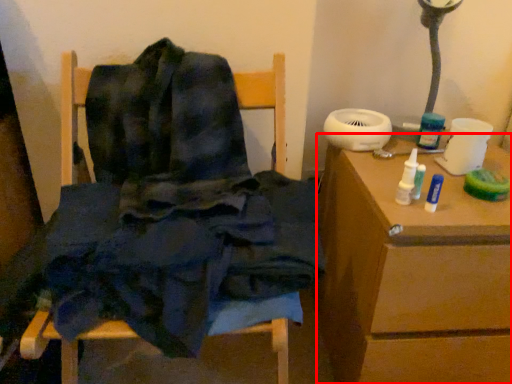
Question: From the image's perspective, where is table (annotated by the red box) located in relation to furniture in the image?

Choices:
 (A) above
 (B) below

Answer: (B)